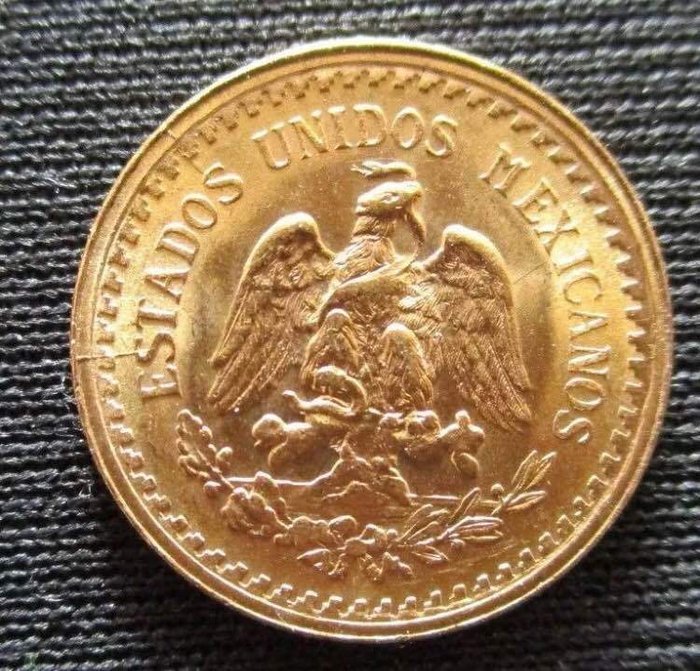
The image size is (700, 671). Find the location of `grey carpet`. grey carpet is located at coordinates (49, 535), (54, 142), (654, 135), (664, 584).